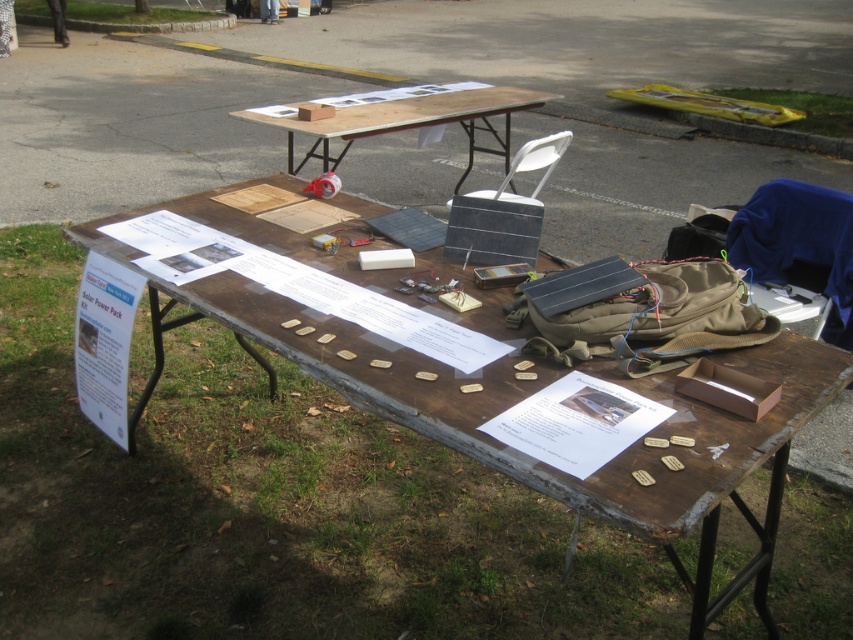
Question: Considering the relative positions of brown wooden table at center and wooden table at center in the image provided, where is brown wooden table at center located with respect to wooden table at center?

Choices:
 (A) below
 (B) above

Answer: (A)

Question: Which point is closer to the camera taking this photo?

Choices:
 (A) (358, 390)
 (B) (473, 145)

Answer: (A)

Question: Is brown wooden table at center below wooden table at center?

Choices:
 (A) no
 (B) yes

Answer: (B)

Question: Can you confirm if brown wooden table at center is positioned below wooden table at center?

Choices:
 (A) yes
 (B) no

Answer: (A)